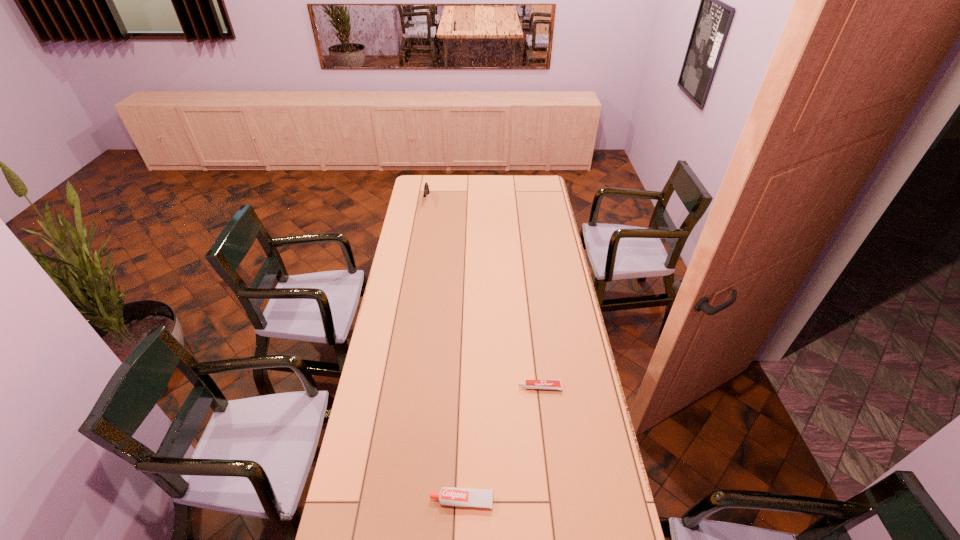
The width and height of the screenshot is (960, 540). In order to click on object that is the closest to the leftmost object in this screenshot , I will do `click(554, 384)`.

The height and width of the screenshot is (540, 960). Identify the location of object that ranks as the closest to the second object from right to left. [554, 384].

Where is `vacant point that satisfies the following two spatial constraints: 1. at the end of the barrel of the tallest object; 2. on the left side of the second shortest object`? vacant point that satisfies the following two spatial constraints: 1. at the end of the barrel of the tallest object; 2. on the left side of the second shortest object is located at coordinates (377, 501).

Identify the location of free space that satisfies the following two spatial constraints: 1. at the nozzle of the shortest object; 2. on the front side of the taller toothpaste. (553, 501).